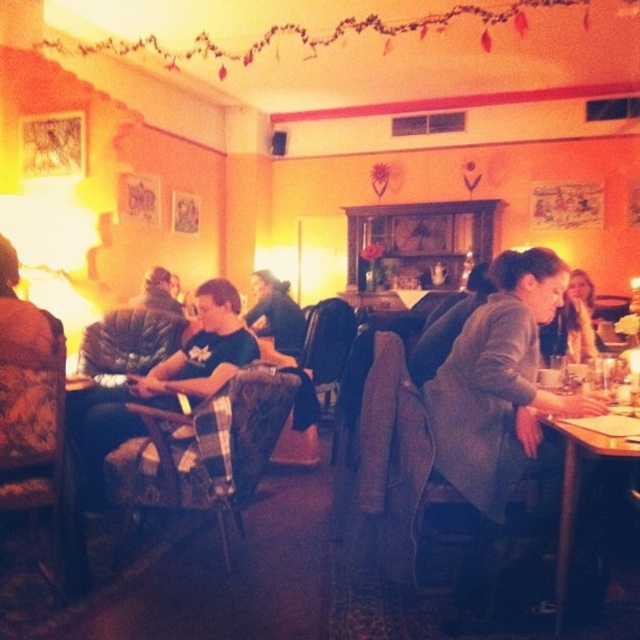
Question: Estimate the real-world distances between objects in this image. Which object is farther from the gray woolen coat at center?

Choices:
 (A) black matte shirt at center
 (B) dark brown leather jacket at center
 (C) matte gray sweater at right

Answer: (B)

Question: Among these objects, which one is farthest from the camera?

Choices:
 (A) black cotton shirt at center
 (B) matte gray sweater at right
 (C) gray woolen coat at center

Answer: (B)

Question: Which is farther from the dark brown leather jacket at center?

Choices:
 (A) black cotton shirt at center
 (B) wooden table at lower right

Answer: (B)

Question: Can you confirm if black cotton shirt at center is positioned to the right of black matte shirt at center?

Choices:
 (A) no
 (B) yes

Answer: (A)

Question: Can you confirm if black cotton shirt at center is positioned above dark brown leather jacket at center?

Choices:
 (A) yes
 (B) no

Answer: (B)

Question: Can you confirm if gray woolen coat at center is bigger than black cotton shirt at center?

Choices:
 (A) yes
 (B) no

Answer: (B)